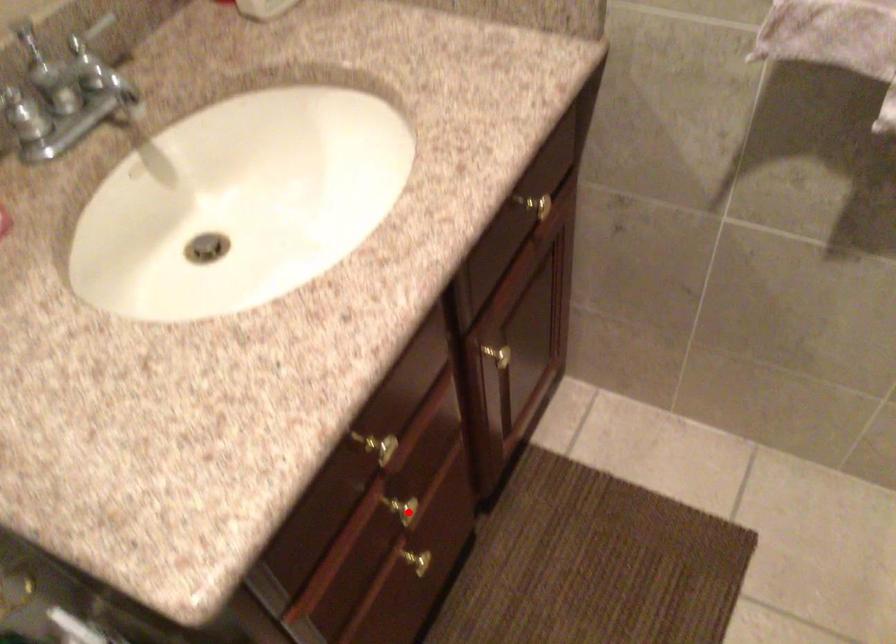
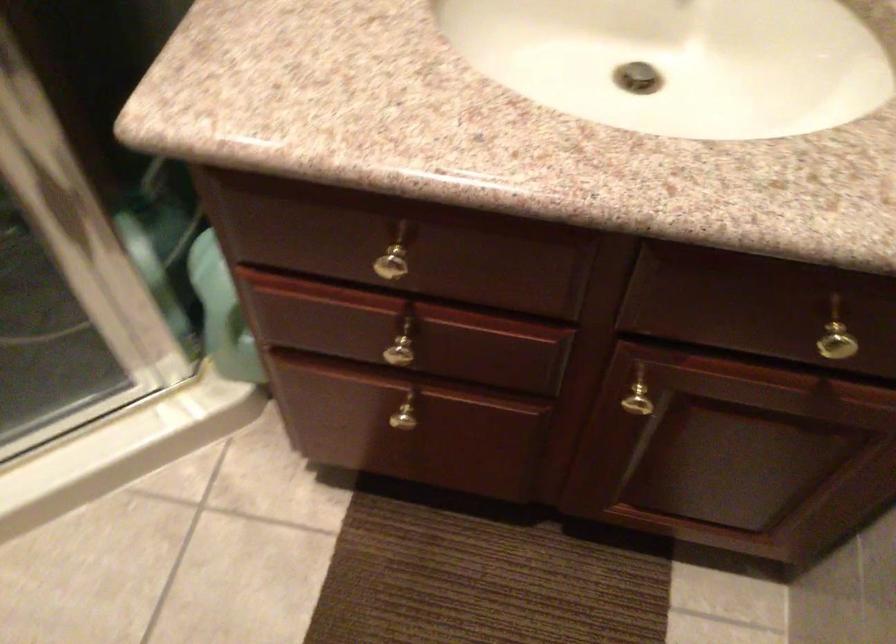
Find the pixel in the second image that matches the highlighted location in the first image.

(401, 354)